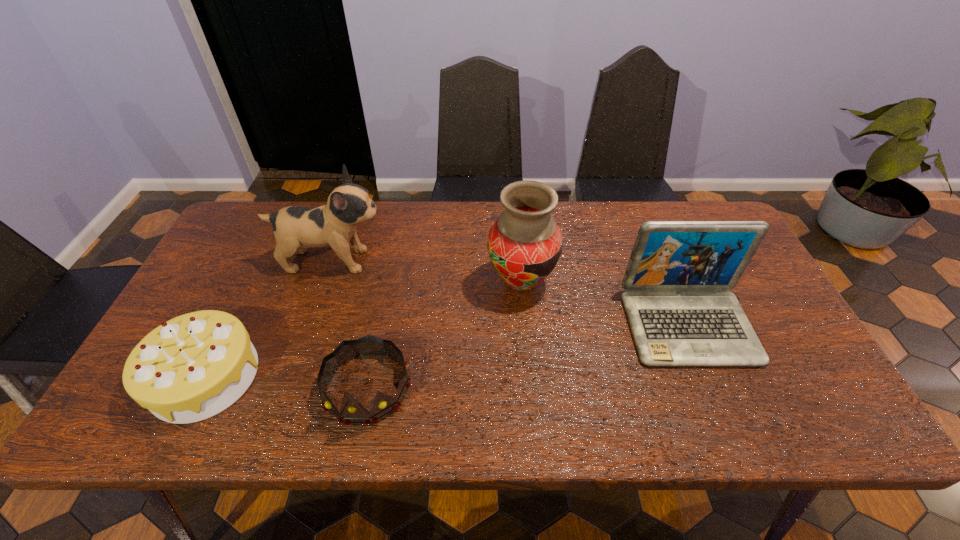
In order to click on unoccupied area between the puppy and the tiara in this screenshot , I will do `click(349, 324)`.

The height and width of the screenshot is (540, 960). What are the coordinates of `free area in between the tiara and the rightmost object` in the screenshot? It's located at (528, 357).

You are a GUI agent. You are given a task and a screenshot of the screen. Output one action in this format:
    pyautogui.click(x=<x>, y=<y>)
    Task: Click on the unoccupied area between the rightmost object and the birthday cake
    This screenshot has width=960, height=540.
    Given the screenshot: What is the action you would take?
    pyautogui.click(x=446, y=351)

Locate an element on the screen. Image resolution: width=960 pixels, height=540 pixels. free space that is in between the tiara and the laptop computer is located at coordinates (528, 357).

Find the location of a particular element. The height and width of the screenshot is (540, 960). vacant area that lies between the laptop computer and the puppy is located at coordinates (511, 293).

Where is `vacant area that lies between the puppy and the birthday cake`? Image resolution: width=960 pixels, height=540 pixels. vacant area that lies between the puppy and the birthday cake is located at coordinates (269, 319).

This screenshot has width=960, height=540. I want to click on vacant space that's between the vase and the laptop computer, so [x=605, y=305].

The image size is (960, 540). What are the coordinates of `free point between the birthday cake and the puppy` in the screenshot? It's located at (269, 319).

Where is `empty location between the puppy and the laptop computer`? The width and height of the screenshot is (960, 540). empty location between the puppy and the laptop computer is located at coordinates (511, 293).

Locate which object is the fourth closest to the birthday cake. Please provide its 2D coordinates. Your answer should be formatted as a tuple, i.e. [(x, y)], where the tuple contains the x and y coordinates of a point satisfying the conditions above.

[(680, 312)]